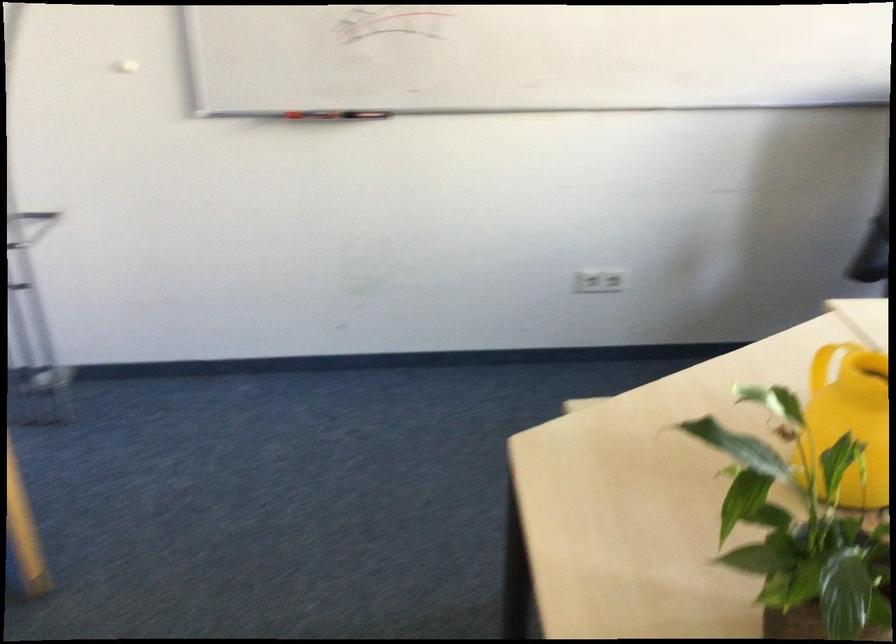
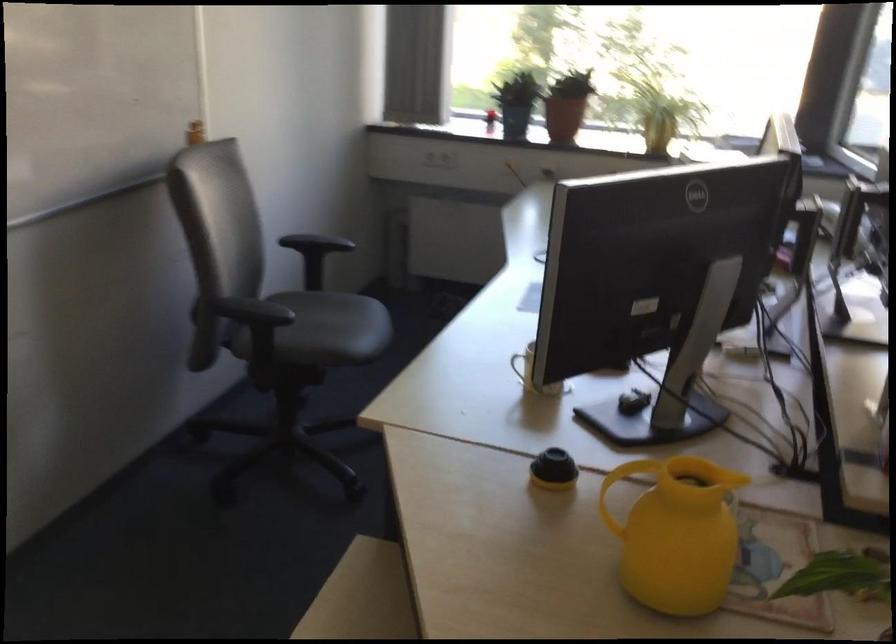
Question: The images are taken continuously from a first-person perspective. In which direction is your viewpoint rotating?

Choices:
 (A) Left
 (B) Right
 (C) Up
 (D) Down

Answer: (B)